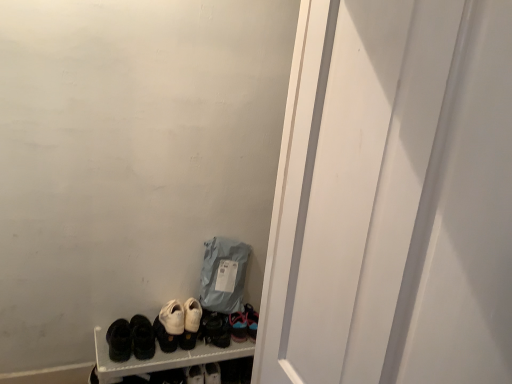
Question: Is white matte screen door at center positioned behind matte gray fabric bag at lower center?

Choices:
 (A) no
 (B) yes

Answer: (A)

Question: Can you confirm if white matte screen door at center is wider than matte gray fabric bag at lower center?

Choices:
 (A) yes
 (B) no

Answer: (B)

Question: Does white matte screen door at center contain matte gray fabric bag at lower center?

Choices:
 (A) no
 (B) yes

Answer: (A)

Question: From a real-world perspective, is white matte screen door at center physically above matte gray fabric bag at lower center?

Choices:
 (A) no
 (B) yes

Answer: (B)

Question: Considering the relative positions of white matte screen door at center and matte gray fabric bag at lower center in the image provided, is white matte screen door at center to the left of matte gray fabric bag at lower center from the viewer's perspective?

Choices:
 (A) yes
 (B) no

Answer: (B)

Question: In the image, is white matte screen door at center positioned in front of or behind black leather sneakers at center, the 1th footwear positioned from the right?

Choices:
 (A) behind
 (B) front

Answer: (B)

Question: Is white matte screen door at center bigger or smaller than black leather sneakers at center, arranged as the fifth footwear when viewed from the left?

Choices:
 (A) big
 (B) small

Answer: (A)

Question: From the image's perspective, relative to black leather sneakers at center, the 1th footwear positioned from the right, is white matte screen door at center above or below?

Choices:
 (A) above
 (B) below

Answer: (A)

Question: In terms of height, does white matte screen door at center look taller or shorter compared to black leather sneakers at center, the 1th footwear positioned from the right?

Choices:
 (A) tall
 (B) short

Answer: (A)

Question: Looking at the image, does white suede sneakers at center, which appears as the 3th footwear when viewed from the right, seem bigger or smaller compared to black leather sneakers at center, the 1th footwear positioned from the right?

Choices:
 (A) big
 (B) small

Answer: (A)

Question: Is white suede sneakers at center, which appears as the 3th footwear when viewed from the right, in front of or behind black leather sneakers at center, arranged as the fifth footwear when viewed from the left, in the image?

Choices:
 (A) front
 (B) behind

Answer: (A)

Question: In terms of width, does white suede sneakers at center, which appears as the 3th footwear when viewed from the left, look wider or thinner when compared to black leather sneakers at center, arranged as the fifth footwear when viewed from the left?

Choices:
 (A) thin
 (B) wide

Answer: (B)

Question: In terms of height, does white suede sneakers at center, which appears as the 3th footwear when viewed from the left, look taller or shorter compared to black leather sneakers at center, the 1th footwear positioned from the right?

Choices:
 (A) tall
 (B) short

Answer: (B)

Question: In terms of width, does white suede sneakers at center, which appears as the 3th footwear when viewed from the right, look wider or thinner when compared to white matte screen door at center?

Choices:
 (A) wide
 (B) thin

Answer: (A)

Question: Would you say white suede sneakers at center, which appears as the 3th footwear when viewed from the left, is to the left or to the right of white matte screen door at center in the picture?

Choices:
 (A) right
 (B) left

Answer: (B)